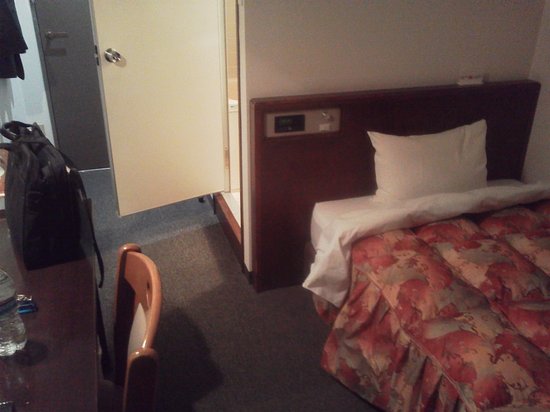
Where is `bed spread`? The height and width of the screenshot is (412, 550). bed spread is located at coordinates (476, 247).